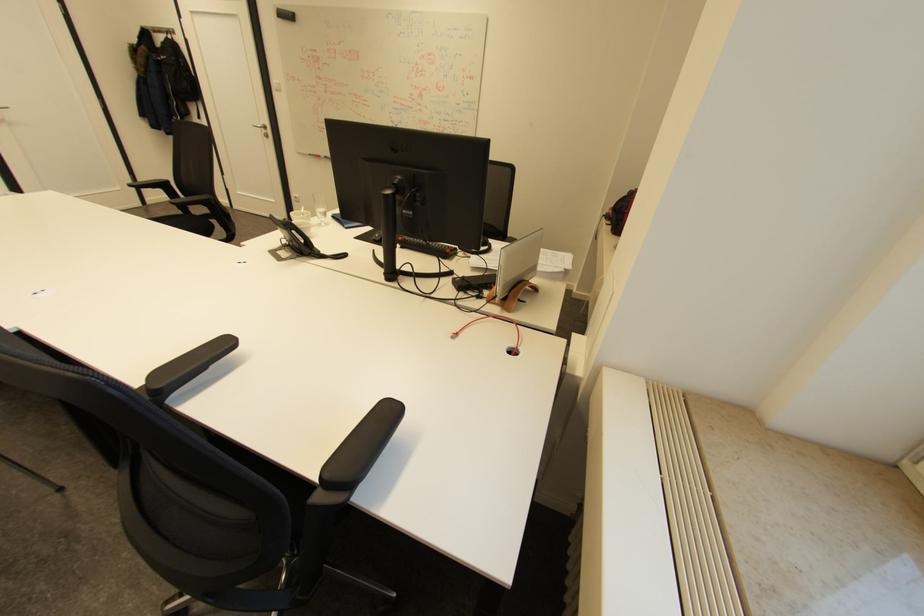
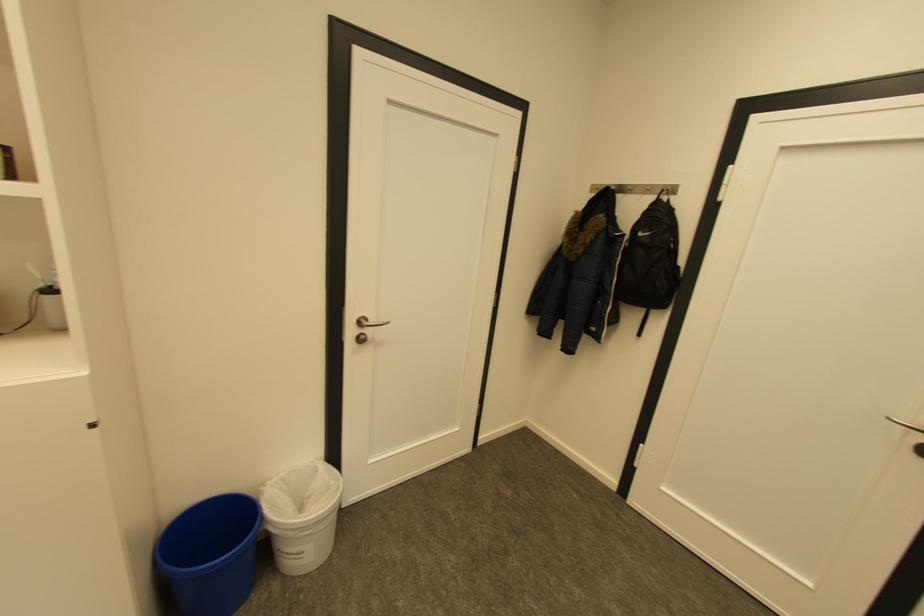
The point at (x=178, y=31) is marked in the first image. Where is the corresponding point in the second image?

(677, 190)